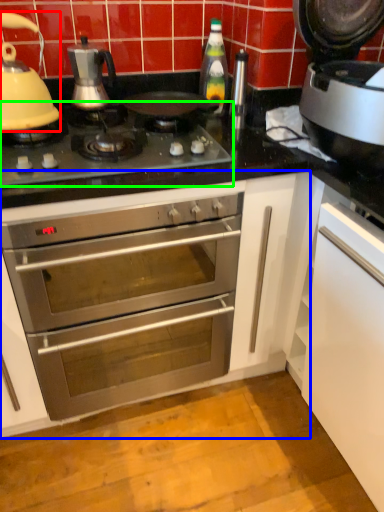
Question: Which object is positioned closest to kitchen appliance (highlighted by a red box)? Select from cabinetry (highlighted by a blue box) and gas stove (highlighted by a green box).

Choices:
 (A) cabinetry
 (B) gas stove

Answer: (B)